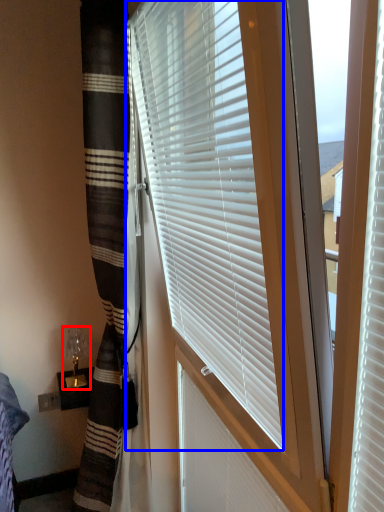
Question: Which point is closer to the camera, table lamp (highlighted by a red box) or window blind (highlighted by a blue box)?

Choices:
 (A) table lamp
 (B) window blind

Answer: (B)